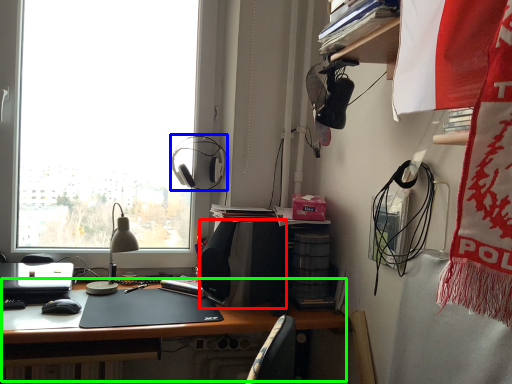
Question: Considering the real-world distances, which object is closest to loudspeaker (highlighted by a red box)? earphone (highlighted by a blue box) or desk (highlighted by a green box).

Choices:
 (A) earphone
 (B) desk

Answer: (B)